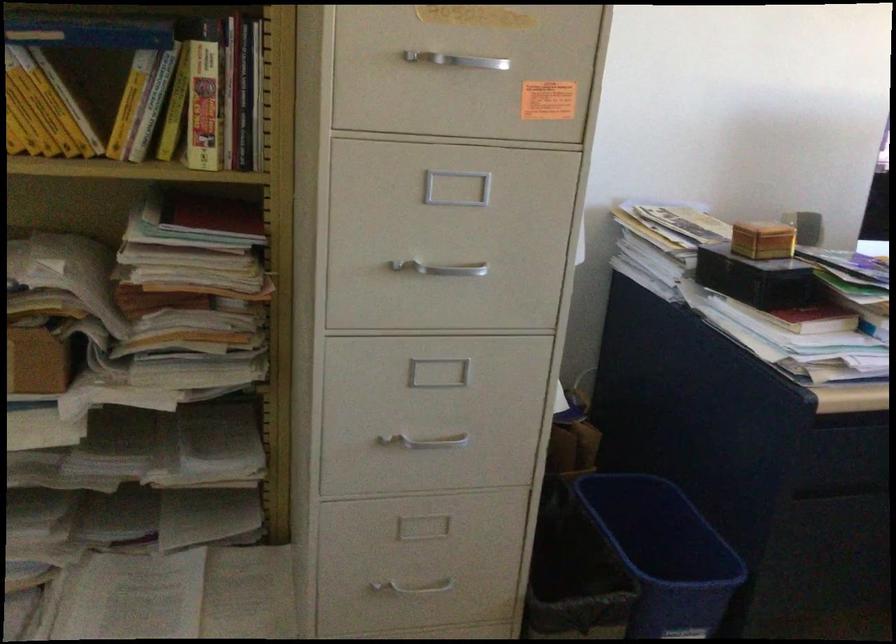
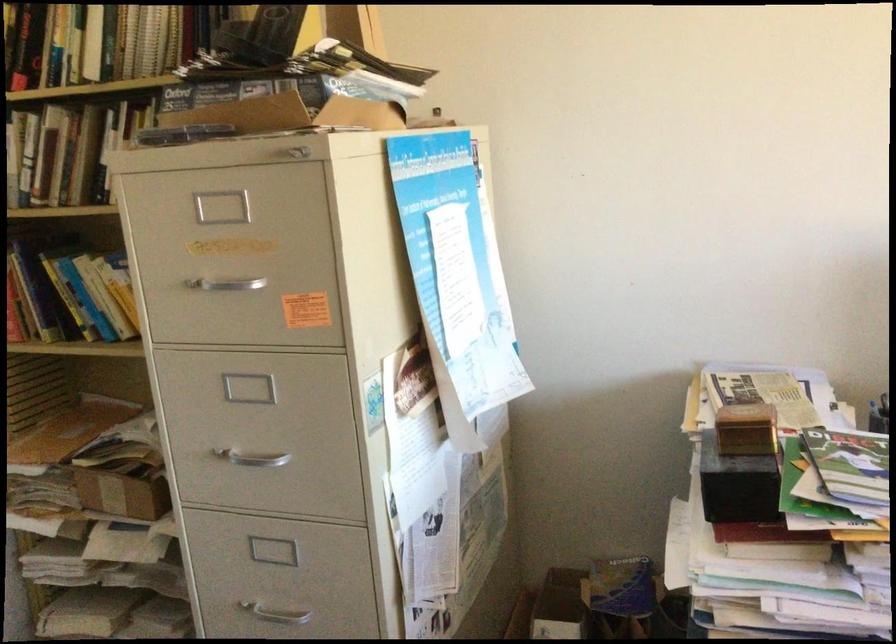
Where in the second image is the point corresponding to (x=431, y=267) from the first image?

(251, 458)